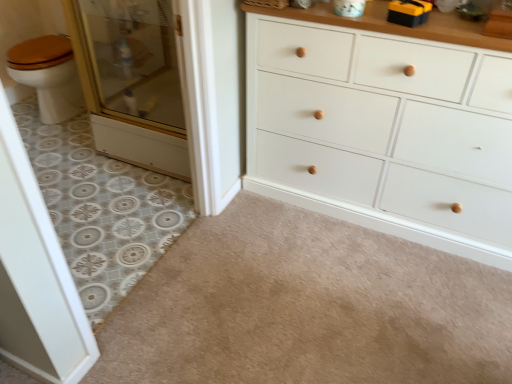
Question: From a real-world perspective, is patterned tile floor at left, the first plain positioned from the left, above or below clear glass screen door at left, acting as the 2th screen door starting from the back?

Choices:
 (A) above
 (B) below

Answer: (B)

Question: In the image, is patterned tile floor at left, the first plain positioned from the left, positioned in front of or behind clear glass screen door at left, marked as the 2th screen door in a top-to-bottom arrangement?

Choices:
 (A) front
 (B) behind

Answer: (B)

Question: Based on their relative distances, which object is nearer to the beige carpet at lower center, positioned as the second plain in left-to-right order?

Choices:
 (A) clear glass screen door at left, which is the 1th screen door in front-to-back order
 (B) white painted wood chest of drawers at center
 (C) clear glass screen door at left, marked as the 1th screen door in a top-to-bottom arrangement
 (D) black plastic tool at upper right
 (E) patterned tile floor at left, arranged as the second plain when viewed from the right

Answer: (B)

Question: Based on their relative distances, which object is nearer to the patterned tile floor at left, the first plain positioned from the left?

Choices:
 (A) clear glass screen door at left, which is counted as the first screen door, starting from the bottom
 (B) white painted wood chest of drawers at center
 (C) clear glass screen door at left, the 2th screen door when ordered from bottom to top
 (D) black plastic tool at upper right
 (E) beige carpet at lower center, positioned as the second plain in left-to-right order

Answer: (C)